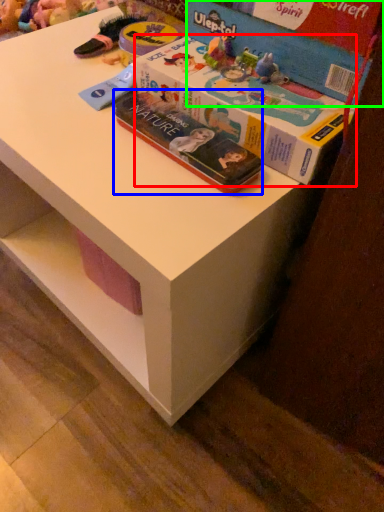
Question: Which is farther away from box (highlighted by a red box)? book (highlighted by a blue box) or box (highlighted by a green box)?

Choices:
 (A) book
 (B) box

Answer: (B)